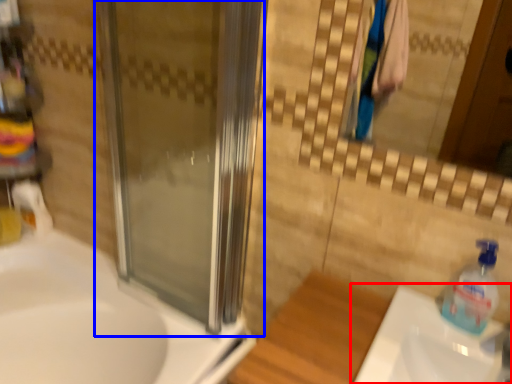
Question: Which object is closer to the camera taking this photo, sink (highlighted by a red box) or screen door (highlighted by a blue box)?

Choices:
 (A) sink
 (B) screen door

Answer: (A)